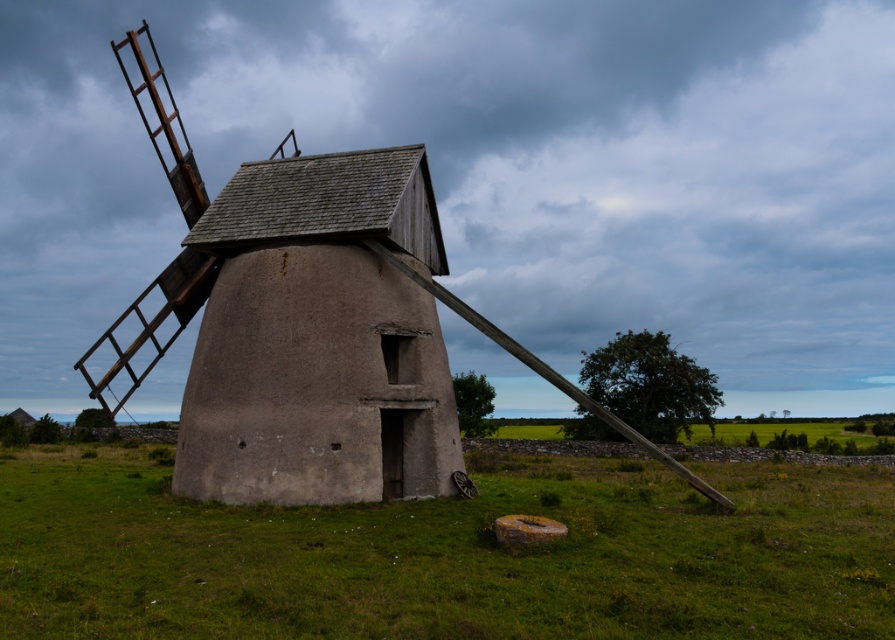
Question: Which is nearer to the brown textured stone windmill at center?

Choices:
 (A) green grass at center
 (B) rustic wood windmill at center

Answer: (B)

Question: Is the position of rustic wood windmill at center more distant than that of brown textured stone windmill at center?

Choices:
 (A) yes
 (B) no

Answer: (B)

Question: Does green grass at center have a greater width compared to rustic wood windmill at center?

Choices:
 (A) no
 (B) yes

Answer: (B)

Question: Which of the following is the farthest from the observer?

Choices:
 (A) rustic wood windmill at center
 (B) brown textured stone windmill at center

Answer: (B)

Question: Which of these objects is positioned closest to the brown textured stone windmill at center?

Choices:
 (A) rustic wood windmill at center
 (B) green grass at center

Answer: (A)

Question: Can you confirm if green grass at center is thinner than rustic wood windmill at center?

Choices:
 (A) yes
 (B) no

Answer: (B)